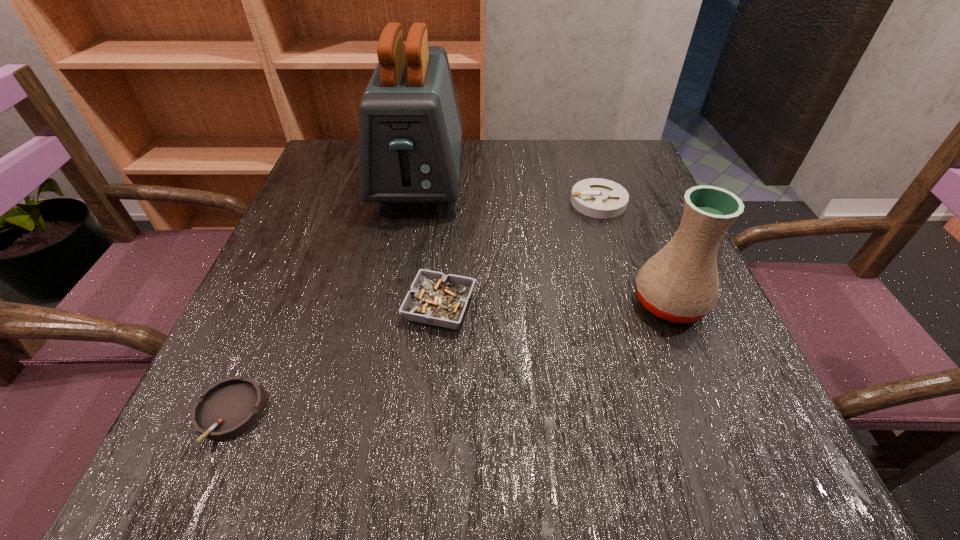
Locate an element on the screen. The image size is (960, 540). vacant area located on the back of the nearest ashtray is located at coordinates (289, 275).

Locate an element on the screen. toaster that is positioned at the far edge is located at coordinates point(410,130).

Where is `ashtray present at the far edge`? ashtray present at the far edge is located at coordinates click(599, 198).

At what (x,y) coordinates should I click in order to perform the action: click on object positioned at the near edge. Please return your answer as a coordinate pair (x, y). Looking at the image, I should click on (229, 407).

At what (x,y) coordinates should I click in order to perform the action: click on toaster that is at the left edge. Please return your answer as a coordinate pair (x, y). Looking at the image, I should click on (410, 130).

The width and height of the screenshot is (960, 540). I want to click on ashtray positioned at the left edge, so [x=229, y=407].

The image size is (960, 540). In order to click on pottery that is positioned at the right edge in this screenshot , I will do `click(680, 283)`.

Identify the location of ashtray located at the right edge. Image resolution: width=960 pixels, height=540 pixels. (599, 198).

Where is `object that is positioned at the far left corner`? object that is positioned at the far left corner is located at coordinates (410, 130).

In order to click on object situated at the near left corner in this screenshot , I will do `click(229, 407)`.